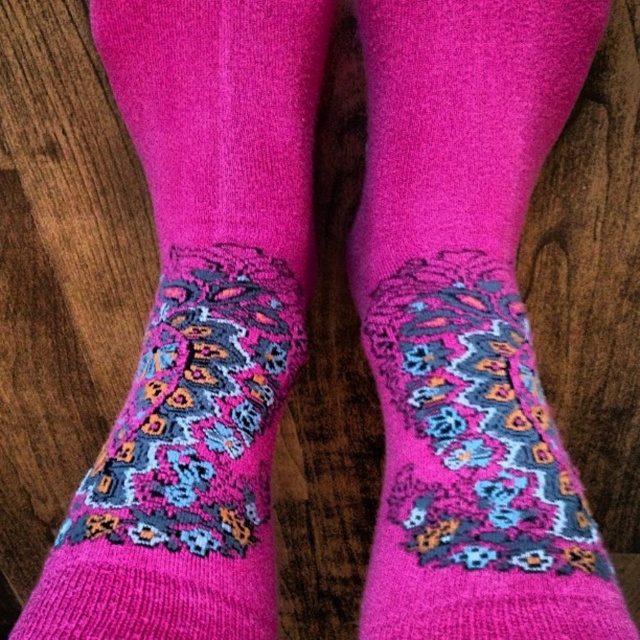
Question: Which point appears farthest from the camera in this image?

Choices:
 (A) (134, 595)
 (B) (452, 269)

Answer: (B)

Question: Is pink knitted socks at center further to the viewer compared to knitted pink socks at center?

Choices:
 (A) yes
 (B) no

Answer: (B)

Question: Does pink knitted socks at center have a lesser width compared to knitted pink socks at center?

Choices:
 (A) no
 (B) yes

Answer: (B)

Question: Does pink knitted socks at center have a greater width compared to knitted pink socks at center?

Choices:
 (A) yes
 (B) no

Answer: (B)